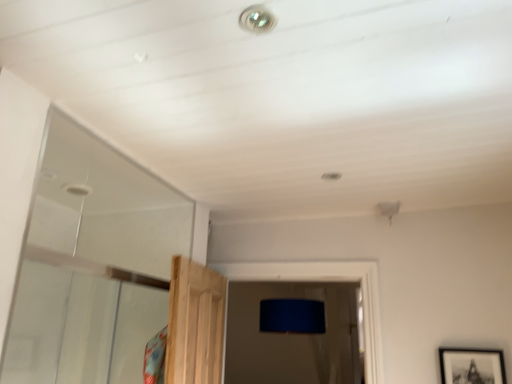
Question: Could black matte picture frame at lower right be considered to be inside metallic droplight at upper center?

Choices:
 (A) yes
 (B) no

Answer: (B)

Question: From a real-world perspective, does metallic droplight at upper center stand above black matte picture frame at lower right?

Choices:
 (A) no
 (B) yes

Answer: (B)

Question: Is metallic droplight at upper center turned away from black matte picture frame at lower right?

Choices:
 (A) no
 (B) yes

Answer: (A)

Question: Is metallic droplight at upper center closer to camera compared to black matte picture frame at lower right?

Choices:
 (A) yes
 (B) no

Answer: (A)

Question: Is metallic droplight at upper center positioned beyond the bounds of black matte picture frame at lower right?

Choices:
 (A) yes
 (B) no

Answer: (A)

Question: From the image's perspective, is metallic droplight at upper center above black matte picture frame at lower right?

Choices:
 (A) no
 (B) yes

Answer: (B)

Question: Is black matte picture frame at lower right to the left of metallic droplight at upper center from the viewer's perspective?

Choices:
 (A) no
 (B) yes

Answer: (A)

Question: Does black matte picture frame at lower right have a smaller size compared to metallic droplight at upper center?

Choices:
 (A) no
 (B) yes

Answer: (A)

Question: Is black matte picture frame at lower right outside metallic droplight at upper center?

Choices:
 (A) yes
 (B) no

Answer: (A)

Question: Does black matte picture frame at lower right lie behind metallic droplight at upper center?

Choices:
 (A) no
 (B) yes

Answer: (B)

Question: Is there a large distance between black matte picture frame at lower right and metallic droplight at upper center?

Choices:
 (A) yes
 (B) no

Answer: (A)

Question: From the image's perspective, is black matte picture frame at lower right on metallic droplight at upper center?

Choices:
 (A) yes
 (B) no

Answer: (B)

Question: From the image's perspective, is black matte picture frame at lower right located above or below metallic droplight at upper center?

Choices:
 (A) above
 (B) below

Answer: (B)